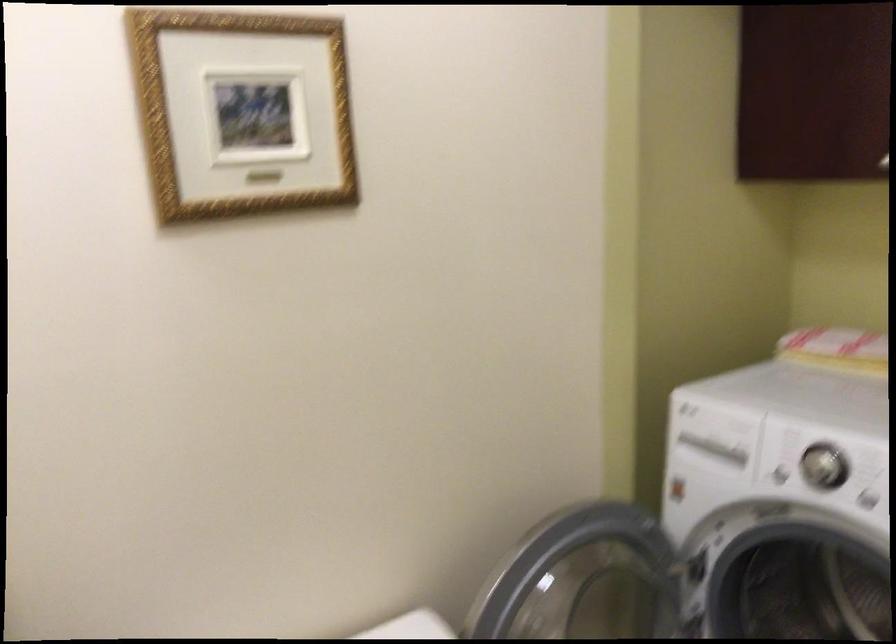
Describe the element at coordinates (708, 451) in the screenshot. The width and height of the screenshot is (896, 644). I see `the silver control dial` at that location.